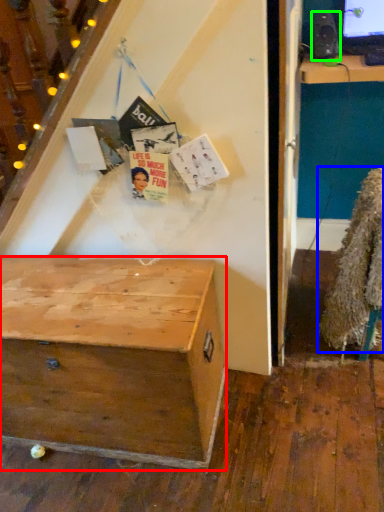
Question: Which object is the closest to the desk (highlighted by a red box)? Choose among these: fur coat (highlighted by a blue box) or loudspeaker (highlighted by a green box).

Choices:
 (A) fur coat
 (B) loudspeaker

Answer: (A)